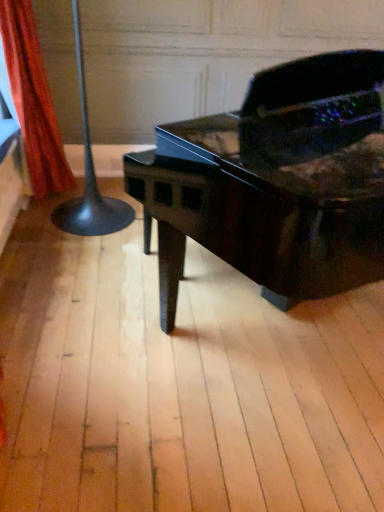
Question: Relative to glossy black piano at center, is orange fabric curtain at left in front or behind?

Choices:
 (A) front
 (B) behind

Answer: (B)

Question: Considering the positions of orange fabric curtain at left and glossy black piano at center in the image, is orange fabric curtain at left taller or shorter than glossy black piano at center?

Choices:
 (A) short
 (B) tall

Answer: (A)

Question: Looking at the image, does orange fabric curtain at left seem bigger or smaller compared to glossy black piano at center?

Choices:
 (A) small
 (B) big

Answer: (A)

Question: Does point [x=382, y=163] appear closer or farther from the camera than point [x=34, y=140]?

Choices:
 (A) farther
 (B) closer

Answer: (B)

Question: From a real-world perspective, is glossy black piano at center above or below orange fabric curtain at left?

Choices:
 (A) above
 (B) below

Answer: (B)

Question: Is glossy black piano at center taller or shorter than orange fabric curtain at left?

Choices:
 (A) tall
 (B) short

Answer: (A)

Question: Looking at the image, does glossy black piano at center seem bigger or smaller compared to orange fabric curtain at left?

Choices:
 (A) big
 (B) small

Answer: (A)